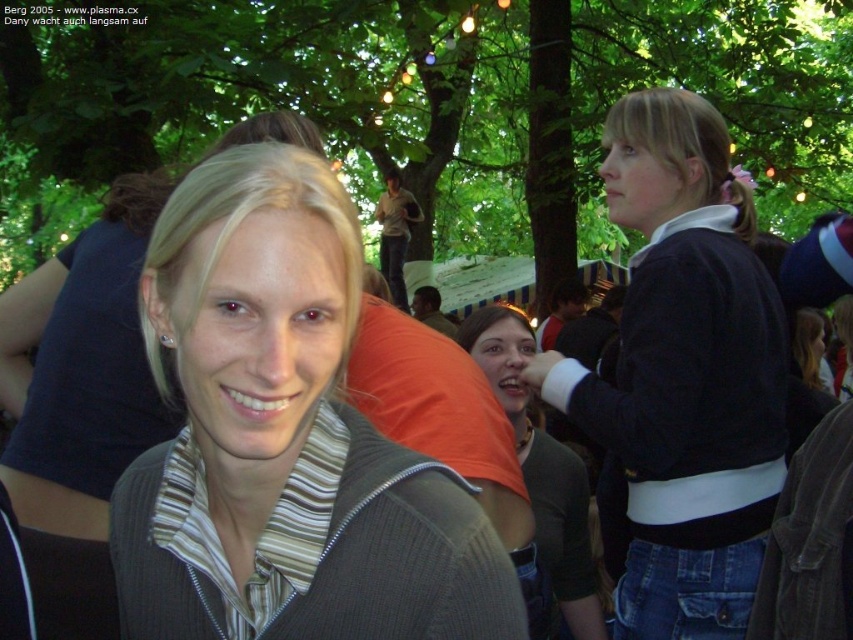
You are at the center of the gathering and want to find the dark blue sweater at right. Which direction should you look to locate it?

The dark blue sweater at right is located at point 0.586 on the x axis and 0.803 on the y axis. Since you are at the center, you should look to the right and slightly upwards to locate it.

Looking at this image, you are at an outdoor gathering and want to take a photo of the matte gray sweater at center and the dark blue sweater at right. Which sweater will appear larger in the photo?

The matte gray sweater at center will appear larger in the photo because it is closer to the camera than the dark blue sweater at right.